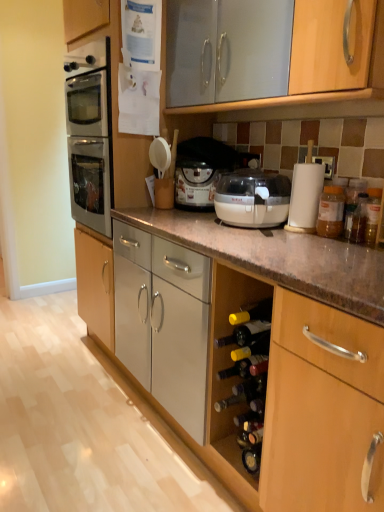
Question: From the image's perspective, is translucent yellow glass wine bottle at lower center below beige plastic food processor at center?

Choices:
 (A) no
 (B) yes

Answer: (B)

Question: Could you tell me if translucent yellow glass wine bottle at lower center is turned towards beige plastic food processor at center?

Choices:
 (A) yes
 (B) no

Answer: (B)

Question: Is translucent yellow glass wine bottle at lower center positioned with its back to beige plastic food processor at center?

Choices:
 (A) no
 (B) yes

Answer: (A)

Question: Does translucent yellow glass wine bottle at lower center contain beige plastic food processor at center?

Choices:
 (A) no
 (B) yes

Answer: (A)

Question: Can you confirm if translucent yellow glass wine bottle at lower center is wider than beige plastic food processor at center?

Choices:
 (A) no
 (B) yes

Answer: (A)

Question: Considering the positions of beige plastic food processor at center and matte white food processor at center in the image, is beige plastic food processor at center bigger or smaller than matte white food processor at center?

Choices:
 (A) big
 (B) small

Answer: (B)

Question: From a real-world perspective, is beige plastic food processor at center positioned above or below matte white food processor at center?

Choices:
 (A) above
 (B) below

Answer: (B)

Question: From the image's perspective, is beige plastic food processor at center positioned above or below matte white food processor at center?

Choices:
 (A) below
 (B) above

Answer: (A)

Question: Considering the positions of beige plastic food processor at center and matte white food processor at center in the image, is beige plastic food processor at center taller or shorter than matte white food processor at center?

Choices:
 (A) tall
 (B) short

Answer: (B)

Question: Considering the positions of point (205, 181) and point (236, 193), is point (205, 181) closer or farther from the camera than point (236, 193)?

Choices:
 (A) farther
 (B) closer

Answer: (A)

Question: Is matte white food processor at center inside the boundaries of beige plastic food processor at center, or outside?

Choices:
 (A) outside
 (B) inside

Answer: (A)

Question: From a real-world perspective, relative to beige plastic food processor at center, is matte white food processor at center vertically above or below?

Choices:
 (A) below
 (B) above

Answer: (B)

Question: Considering the positions of matte white food processor at center and beige plastic food processor at center in the image, is matte white food processor at center bigger or smaller than beige plastic food processor at center?

Choices:
 (A) small
 (B) big

Answer: (B)

Question: Is translucent plastic jar at right wider or thinner than translucent yellow glass wine bottle at lower center?

Choices:
 (A) thin
 (B) wide

Answer: (A)

Question: Choose the correct answer: Is translucent plastic jar at right inside translucent yellow glass wine bottle at lower center or outside it?

Choices:
 (A) outside
 (B) inside

Answer: (A)